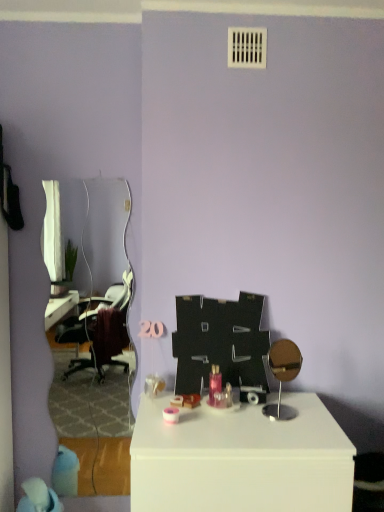
Question: Does white glossy mirror at left appear on the right side of white glossy table at center?

Choices:
 (A) no
 (B) yes

Answer: (A)

Question: Is the depth of white glossy mirror at left greater than that of white glossy table at center?

Choices:
 (A) no
 (B) yes

Answer: (B)

Question: Is white glossy mirror at left located outside white glossy table at center?

Choices:
 (A) yes
 (B) no

Answer: (A)

Question: Is white glossy mirror at left facing away from white glossy table at center?

Choices:
 (A) yes
 (B) no

Answer: (B)

Question: From a real-world perspective, is white glossy mirror at left positioned over white glossy table at center based on gravity?

Choices:
 (A) yes
 (B) no

Answer: (A)

Question: From the image's perspective, is blue fabric bean bag chair at lower left positioned above or below white glossy mirror at left?

Choices:
 (A) above
 (B) below

Answer: (B)

Question: Considering the positions of blue fabric bean bag chair at lower left and white glossy mirror at left in the image, is blue fabric bean bag chair at lower left wider or thinner than white glossy mirror at left?

Choices:
 (A) thin
 (B) wide

Answer: (B)

Question: Based on their positions, is blue fabric bean bag chair at lower left located to the left or right of white glossy mirror at left?

Choices:
 (A) left
 (B) right

Answer: (A)

Question: Based on their sizes in the image, would you say blue fabric bean bag chair at lower left is bigger or smaller than white glossy mirror at left?

Choices:
 (A) small
 (B) big

Answer: (A)

Question: Does point (352, 444) appear closer or farther from the camera than point (54, 499)?

Choices:
 (A) closer
 (B) farther

Answer: (A)

Question: Considering the positions of white glossy table at center and blue fabric bean bag chair at lower left in the image, is white glossy table at center taller or shorter than blue fabric bean bag chair at lower left?

Choices:
 (A) short
 (B) tall

Answer: (B)

Question: Would you say white glossy table at center is to the left or to the right of blue fabric bean bag chair at lower left in the picture?

Choices:
 (A) left
 (B) right

Answer: (B)

Question: Is white glossy table at center in front of or behind blue fabric bean bag chair at lower left in the image?

Choices:
 (A) front
 (B) behind

Answer: (A)

Question: Is white glossy table at center in front of or behind white glossy mirror at left in the image?

Choices:
 (A) behind
 (B) front

Answer: (B)

Question: From a real-world perspective, is white glossy table at center physically located above or below white glossy mirror at left?

Choices:
 (A) below
 (B) above

Answer: (A)